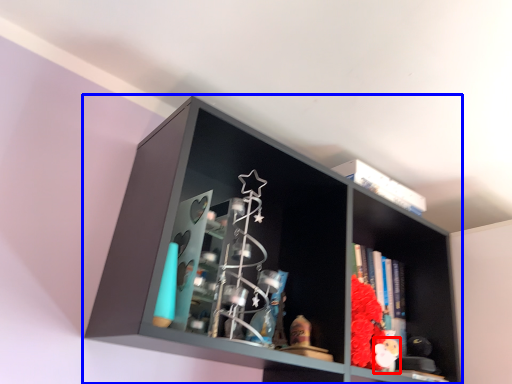
Question: Which object appears farthest to the camera in this image, toy (highlighted by a red box) or shelf (highlighted by a blue box)?

Choices:
 (A) toy
 (B) shelf

Answer: (A)